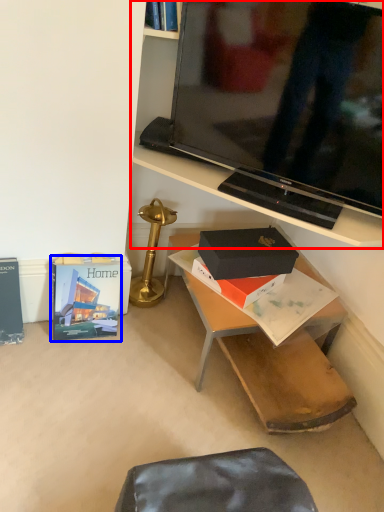
Question: Which point is further to the camera, shelf (highlighted by a red box) or paperback book (highlighted by a blue box)?

Choices:
 (A) shelf
 (B) paperback book

Answer: (B)